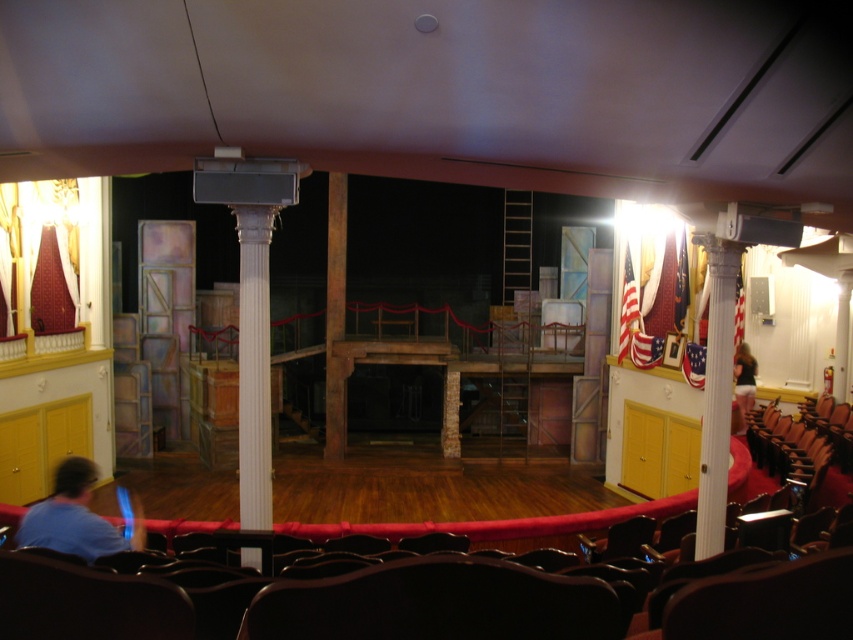
You are an actor preparing to walk from the stage to the audience seats. You see the white glossy column at center and the blue shirt at lower left. Which object is narrower when viewed from the front?

The white glossy column at center is thinner than the blue shirt at lower left, so the white glossy column at center is narrower when viewed from the front.

You are a stagehand standing at the camera position. You need to move a heavy equipment cart to the white glossy column at center. The cart is 2.5 meters wide. Is there enough space between you and the column to maneuver the cart?

The distance between the white glossy column at center and the camera is 10.68 feet, which is approximately 3.26 meters. Since the cart is 2.5 meters wide, there is enough space to maneuver it between the camera position and the column.